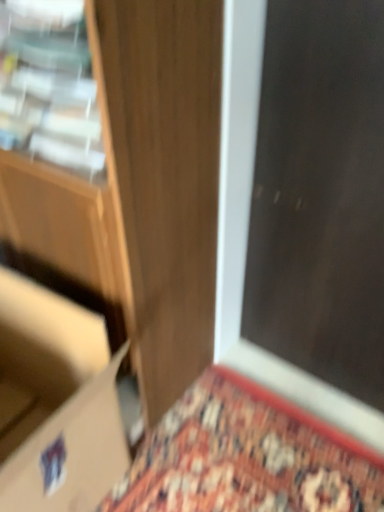
Question: Could you tell me if wooden door at center is turned towards matte cardboard box at lower left?

Choices:
 (A) no
 (B) yes

Answer: (B)

Question: Can you confirm if wooden door at center is thinner than matte cardboard box at lower left?

Choices:
 (A) yes
 (B) no

Answer: (B)

Question: Is wooden door at center at the left side of matte cardboard box at lower left?

Choices:
 (A) no
 (B) yes

Answer: (A)

Question: From the image's perspective, is wooden door at center below matte cardboard box at lower left?

Choices:
 (A) no
 (B) yes

Answer: (A)

Question: Is the depth of wooden door at center greater than that of matte cardboard box at lower left?

Choices:
 (A) yes
 (B) no

Answer: (B)

Question: Is wooden door at center taller than matte cardboard box at lower left?

Choices:
 (A) no
 (B) yes

Answer: (B)

Question: Is dark wood screen door at upper right facing away from wooden door at center?

Choices:
 (A) no
 (B) yes

Answer: (A)

Question: From the image's perspective, is dark wood screen door at upper right located beneath wooden door at center?

Choices:
 (A) no
 (B) yes

Answer: (B)

Question: Considering the relative sizes of dark wood screen door at upper right and wooden door at center in the image provided, is dark wood screen door at upper right smaller than wooden door at center?

Choices:
 (A) yes
 (B) no

Answer: (A)

Question: Considering the relative positions of dark wood screen door at upper right and wooden door at center in the image provided, is dark wood screen door at upper right in front of wooden door at center?

Choices:
 (A) no
 (B) yes

Answer: (A)

Question: Is dark wood screen door at upper right further to the viewer compared to wooden door at center?

Choices:
 (A) yes
 (B) no

Answer: (A)

Question: Is dark wood screen door at upper right shorter than wooden door at center?

Choices:
 (A) yes
 (B) no

Answer: (B)

Question: Is matte cardboard box at lower left to the left of dark wood screen door at upper right from the viewer's perspective?

Choices:
 (A) no
 (B) yes

Answer: (B)